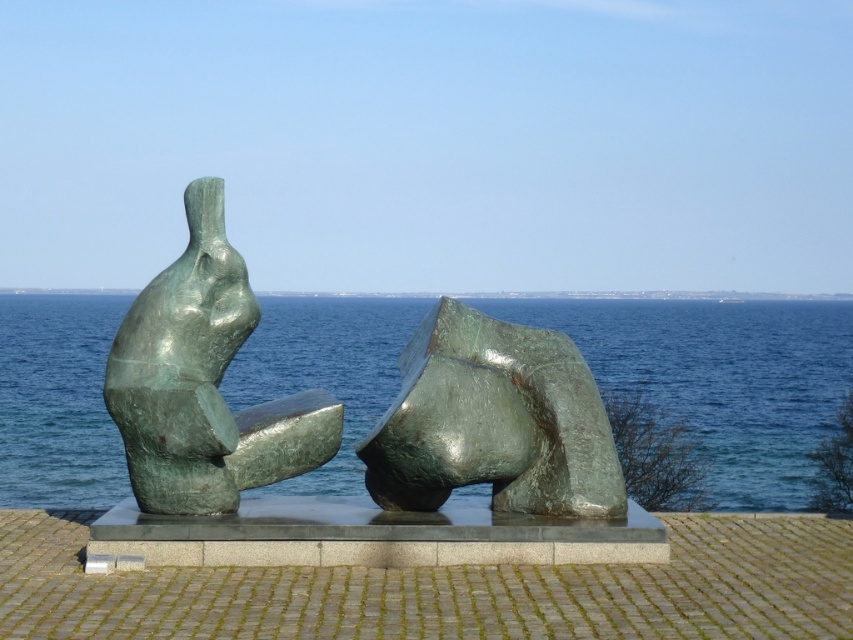
Question: From the image, what is the correct spatial relationship of green metallic water at center in relation to green patina sculpture at left?

Choices:
 (A) left
 (B) right

Answer: (B)

Question: Is green polished stone abstract form at center wider than green patina sculpture at left?

Choices:
 (A) no
 (B) yes

Answer: (A)

Question: Which of the following is the farthest from the observer?

Choices:
 (A) (238, 285)
 (B) (473, 346)

Answer: (B)

Question: Which point is farther from the camera taking this photo?

Choices:
 (A) [198, 284]
 (B) [431, 356]
 (C) [701, 426]

Answer: (C)

Question: Which object is positioned farthest from the green polished stone abstract form at center?

Choices:
 (A) green patina sculpture at left
 (B) green metallic water at center

Answer: (B)

Question: Does green polished stone abstract form at center appear under green patina sculpture at left?

Choices:
 (A) yes
 (B) no

Answer: (A)